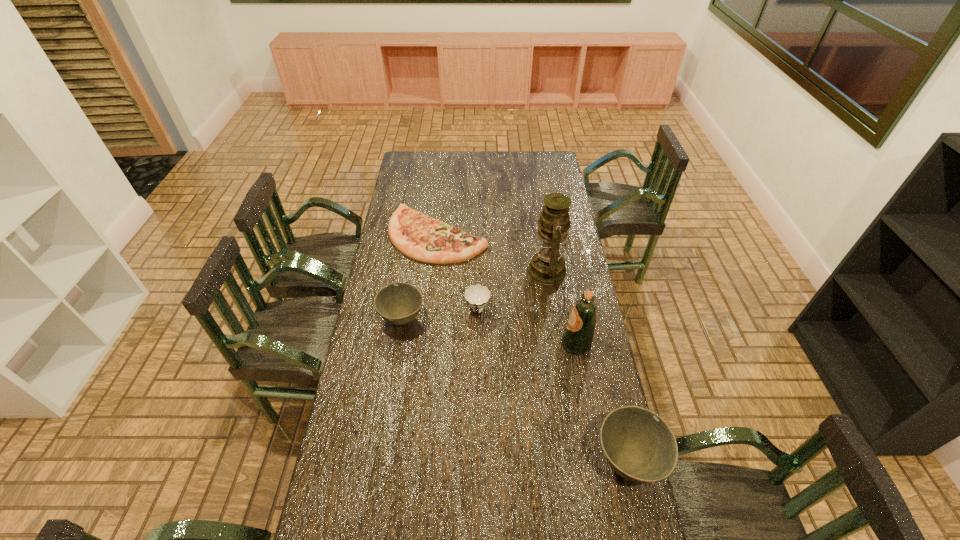
I want to click on oil lamp present at the right edge, so click(x=547, y=266).

Identify the location of olive oil present at the right edge. (578, 336).

Identify the location of object situated at the near right corner. (638, 445).

You are a GUI agent. You are given a task and a screenshot of the screen. Output one action in this format:
    pyautogui.click(x=<x>, y=<y>)
    Task: Click on the vacant space at the far edge of the desktop
    
    Given the screenshot: What is the action you would take?
    pyautogui.click(x=472, y=164)

Where is `free point at the near edge`? This screenshot has width=960, height=540. free point at the near edge is located at coordinates (575, 508).

Locate an element on the screen. Image resolution: width=960 pixels, height=540 pixels. vacant space at the left edge of the desktop is located at coordinates (403, 272).

In the image, there is a desktop. What are the coordinates of `vacant space at the right edge` in the screenshot? It's located at (566, 325).

You are a GUI agent. You are given a task and a screenshot of the screen. Output one action in this format:
    pyautogui.click(x=<x>, y=<y>)
    Task: Click on the free space at the far left corner of the desktop
    Image resolution: width=960 pixels, height=540 pixels.
    Given the screenshot: What is the action you would take?
    pyautogui.click(x=415, y=152)

In the image, there is a desktop. At what (x,y) coordinates should I click in order to perform the action: click on free region at the far right corner. Please return your answer as a coordinate pair (x, y). Image resolution: width=960 pixels, height=540 pixels. Looking at the image, I should click on (533, 169).

The image size is (960, 540). I want to click on vacant space that is in between the olive oil and the farther bowl, so click(490, 332).